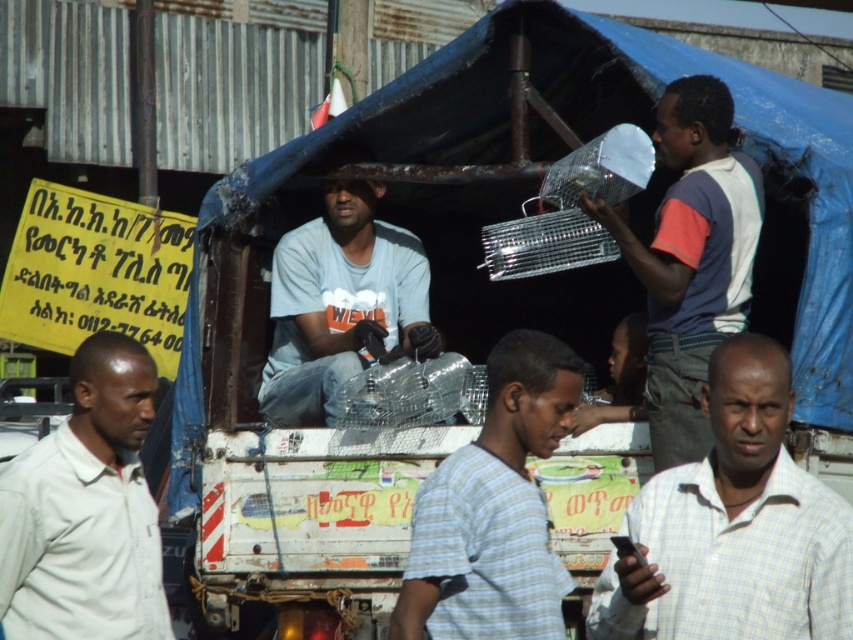
Is white checkered shirt at center smaller than smooth skin face at center?

No, white checkered shirt at center is not smaller than smooth skin face at center.

Which of these two, white checkered shirt at center or smooth skin face at center, stands taller?

Standing taller between the two is white checkered shirt at center.

Find the location of a particular element. This screenshot has height=640, width=853. white checkered shirt at center is located at coordinates (734, 525).

Can you confirm if white checkered shirt at center is taller than matte gray shirt at center?

Incorrect, white checkered shirt at center's height is not larger of matte gray shirt at center's.

Is white checkered shirt at center smaller than matte gray shirt at center?

Yes.

Is point (772, 602) closer to viewer compared to point (332, 276)?

Yes, it is.

Find the location of a particular element. white checkered shirt at center is located at coordinates (734, 525).

Is white matte shirt at left shorter than white plastic bag at upper right?

Correct, white matte shirt at left is not as tall as white plastic bag at upper right.

Does white matte shirt at left have a larger size compared to white plastic bag at upper right?

Answer: Yes.

Is point (123, 426) behind point (717, 337)?

That is True.

This screenshot has height=640, width=853. Find the location of `white matte shirt at left`. white matte shirt at left is located at coordinates (86, 509).